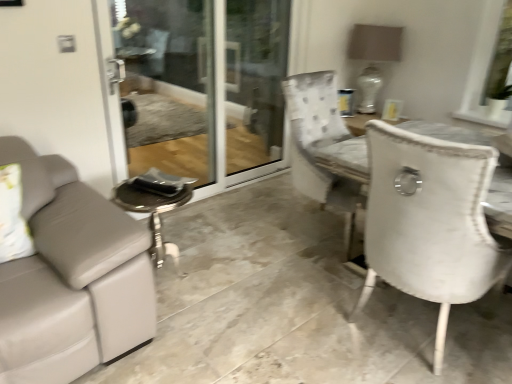
The width and height of the screenshot is (512, 384). What do you see at coordinates (375, 43) in the screenshot? I see `white ceramic lamp at upper right` at bounding box center [375, 43].

The image size is (512, 384). I want to click on white ceramic lamp at upper right, so pos(375,43).

Find the location of a particular element. Image resolution: width=512 pixels, height=384 pixels. lamp behind the white fabric window screen at upper right is located at coordinates (375, 43).

Is white ceramic lamp at upper right not near white fabric window screen at upper right?

white ceramic lamp at upper right is near white fabric window screen at upper right, not far away.

Is white ceramic lamp at upper right shorter than white fabric window screen at upper right?

No, white ceramic lamp at upper right is not shorter than white fabric window screen at upper right.

From the image's perspective, is white ceramic lamp at upper right located above or below white fabric window screen at upper right?

white ceramic lamp at upper right is above white fabric window screen at upper right.

Identify the location of screen door beneath the white ceramic lamp at upper right (from a real-world perspective). (202, 84).

Would you say transparent glass screen door at center is outside white ceramic lamp at upper right?

Result: Yes, transparent glass screen door at center is located beyond the bounds of white ceramic lamp at upper right.

Can you see transparent glass screen door at center touching white ceramic lamp at upper right?

No, transparent glass screen door at center is not next to white ceramic lamp at upper right.

Between point (122, 53) and point (369, 87), which one is positioned behind?

The point (122, 53) is farther.

From the image's perspective, is transparent glass screen door at center below white fabric window screen at upper right?

Yes.

From a real-world perspective, is transparent glass screen door at center physically located above or below white fabric window screen at upper right?

From a real-world perspective, transparent glass screen door at center is physically below white fabric window screen at upper right.

Is transparent glass screen door at center turned away from white fabric window screen at upper right?

transparent glass screen door at center is not turned away from white fabric window screen at upper right.

Is transparent glass screen door at center at the left side of white fabric window screen at upper right?

Yes.

Choose the correct answer: Is white fabric window screen at upper right inside white ceramic lamp at upper right or outside it?

white fabric window screen at upper right is not inside white ceramic lamp at upper right, it's outside.

Would you say white fabric window screen at upper right is a long distance from white ceramic lamp at upper right?

Actually, white fabric window screen at upper right and white ceramic lamp at upper right are a little close together.

Looking at this image, from a real-world perspective, is white fabric window screen at upper right below white ceramic lamp at upper right?

No, from a real-world perspective, white fabric window screen at upper right is not below white ceramic lamp at upper right.

Considering the relative sizes of white fabric window screen at upper right and white ceramic lamp at upper right in the image provided, is white fabric window screen at upper right thinner than white ceramic lamp at upper right?

Indeed, white fabric window screen at upper right has a lesser width compared to white ceramic lamp at upper right.

This screenshot has width=512, height=384. I want to click on lamp that is behind the transparent glass screen door at center, so click(x=375, y=43).

Which object is closer to the camera taking this photo, white ceramic lamp at upper right or transparent glass screen door at center?

transparent glass screen door at center is more forward.

Considering the sizes of objects white ceramic lamp at upper right and transparent glass screen door at center in the image provided, who is smaller, white ceramic lamp at upper right or transparent glass screen door at center?

white ceramic lamp at upper right is smaller.

Considering the points (382, 83) and (259, 161), which point is in front, point (382, 83) or point (259, 161)?

The point (382, 83) is more forward.

Is white fabric window screen at upper right not near transparent glass screen door at center?

Yes, white fabric window screen at upper right and transparent glass screen door at center are located far from each other.

Is transparent glass screen door at center inside white fabric window screen at upper right?

That's incorrect, transparent glass screen door at center is not inside white fabric window screen at upper right.

Locate an element on the screen. lamp behind the white fabric window screen at upper right is located at coordinates (375, 43).

Image resolution: width=512 pixels, height=384 pixels. Identify the location of screen door in front of the white ceramic lamp at upper right. (202, 84).

From the image, which object appears to be nearer to white fabric window screen at upper right, white ceramic lamp at upper right or transparent glass screen door at center?

white ceramic lamp at upper right.

From the picture: Considering their positions, is transparent glass screen door at center positioned further to white fabric window screen at upper right than white ceramic lamp at upper right?

The object further to white fabric window screen at upper right is transparent glass screen door at center.

Looking at this image, looking at the image, which one is located further to white ceramic lamp at upper right, transparent glass screen door at center or white fabric window screen at upper right?

transparent glass screen door at center is positioned further to the anchor white ceramic lamp at upper right.

Estimate the real-world distances between objects in this image. Which object is closer to transparent glass screen door at center, white ceramic lamp at upper right or white fabric window screen at upper right?

Among the two, white ceramic lamp at upper right is located nearer to transparent glass screen door at center.

Considering their positions, is white fabric window screen at upper right positioned further to white ceramic lamp at upper right than transparent glass screen door at center?

The object further to white ceramic lamp at upper right is transparent glass screen door at center.

Looking at the image, which one is located further to transparent glass screen door at center, white fabric window screen at upper right or white ceramic lamp at upper right?

white fabric window screen at upper right is further to transparent glass screen door at center.

I want to click on lamp between transparent glass screen door at center and white fabric window screen at upper right from left to right, so click(x=375, y=43).